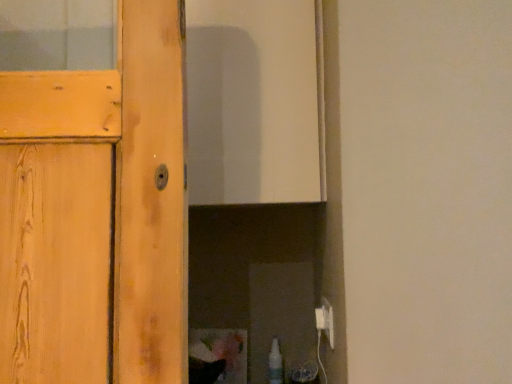
Question: Is translucent plastic spray bottle at lower right situated inside white plastic electric outlet at lower right or outside?

Choices:
 (A) inside
 (B) outside

Answer: (B)

Question: From the image's perspective, is translucent plastic spray bottle at lower right above or below white plastic electric outlet at lower right?

Choices:
 (A) above
 (B) below

Answer: (B)

Question: Relative to white plastic electric outlet at lower right, is translucent plastic spray bottle at lower right in front or behind?

Choices:
 (A) front
 (B) behind

Answer: (B)

Question: Choose the correct answer: Is white plastic electric outlet at lower right inside translucent plastic spray bottle at lower right or outside it?

Choices:
 (A) outside
 (B) inside

Answer: (A)

Question: Visually, is white plastic electric outlet at lower right positioned to the left or to the right of translucent plastic spray bottle at lower right?

Choices:
 (A) right
 (B) left

Answer: (A)

Question: Considering the positions of white plastic electric outlet at lower right and translucent plastic spray bottle at lower right in the image, is white plastic electric outlet at lower right wider or thinner than translucent plastic spray bottle at lower right?

Choices:
 (A) wide
 (B) thin

Answer: (B)

Question: Relative to translucent plastic spray bottle at lower right, is white plastic electric outlet at lower right in front or behind?

Choices:
 (A) behind
 (B) front

Answer: (B)